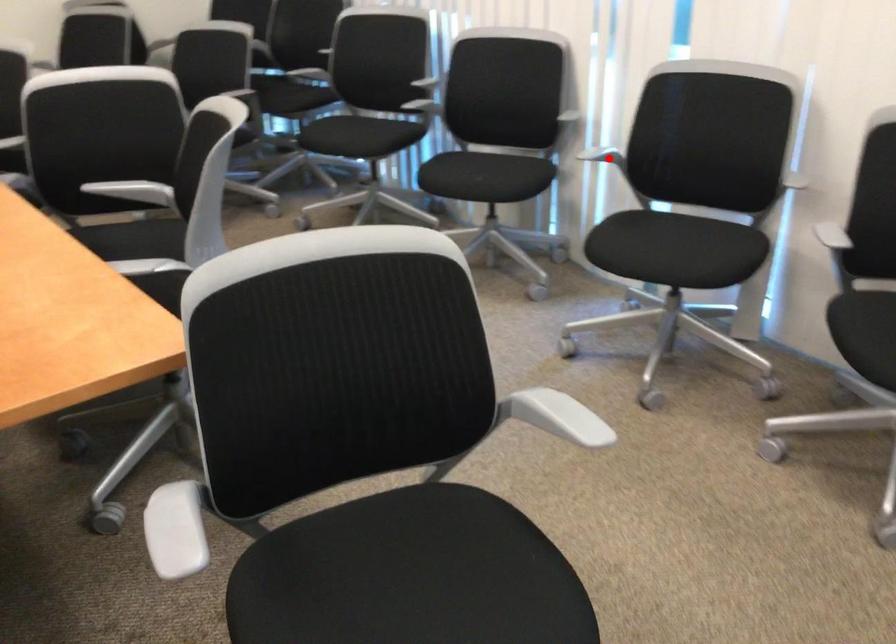
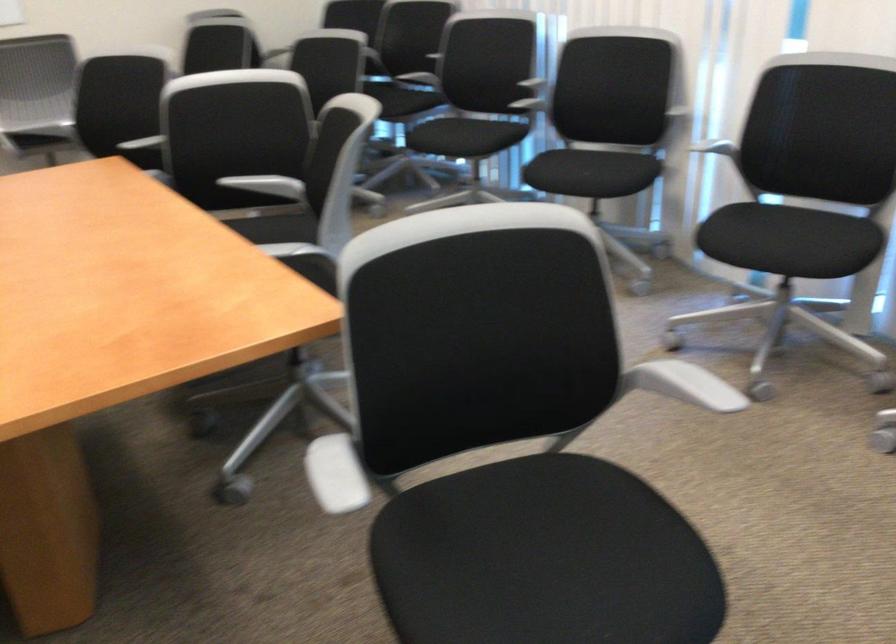
Where in the second image is the point corresponding to the highlighted location from the first image?

(718, 149)